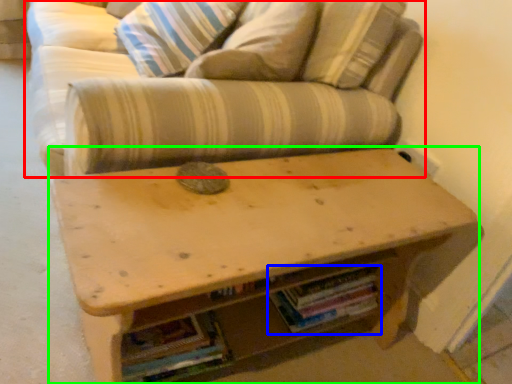
Question: Which is farther away from studio couch (highlighted by a red box)? book (highlighted by a blue box) or table (highlighted by a green box)?

Choices:
 (A) book
 (B) table

Answer: (A)